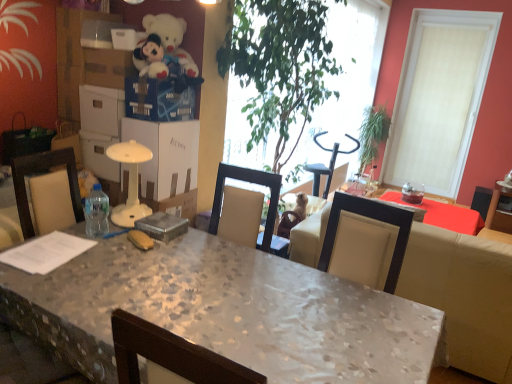
Question: Is white textured window at upper right positioned far away from beige leather couch at center?

Choices:
 (A) yes
 (B) no

Answer: (A)

Question: Can you confirm if white textured window at upper right is smaller than beige leather couch at center?

Choices:
 (A) yes
 (B) no

Answer: (A)

Question: Considering the relative positions of white textured window at upper right and beige leather couch at center in the image provided, is white textured window at upper right behind beige leather couch at center?

Choices:
 (A) no
 (B) yes

Answer: (B)

Question: Can you confirm if white textured window at upper right is positioned to the right of beige leather couch at center?

Choices:
 (A) yes
 (B) no

Answer: (A)

Question: Considering the relative sizes of white textured window at upper right and beige leather couch at center in the image provided, is white textured window at upper right taller than beige leather couch at center?

Choices:
 (A) yes
 (B) no

Answer: (A)

Question: Is white textured window at upper right positioned before beige leather couch at center?

Choices:
 (A) yes
 (B) no

Answer: (B)

Question: Can you confirm if white plush teddy bear at upper left is thinner than clear plastic bottle at table left?

Choices:
 (A) no
 (B) yes

Answer: (A)

Question: Does white plush teddy bear at upper left have a smaller size compared to clear plastic bottle at table left?

Choices:
 (A) no
 (B) yes

Answer: (A)

Question: Is white plush teddy bear at upper left taller than clear plastic bottle at table left?

Choices:
 (A) no
 (B) yes

Answer: (B)

Question: Is white plush teddy bear at upper left oriented towards clear plastic bottle at table left?

Choices:
 (A) yes
 (B) no

Answer: (B)

Question: Is white plush teddy bear at upper left at the right side of clear plastic bottle at table left?

Choices:
 (A) yes
 (B) no

Answer: (A)

Question: Is white plush teddy bear at upper left not near clear plastic bottle at table left?

Choices:
 (A) yes
 (B) no

Answer: (B)

Question: Is green leafy plant at center, the first houseplant from the left, outside white plush teddy bear at upper left?

Choices:
 (A) yes
 (B) no

Answer: (A)